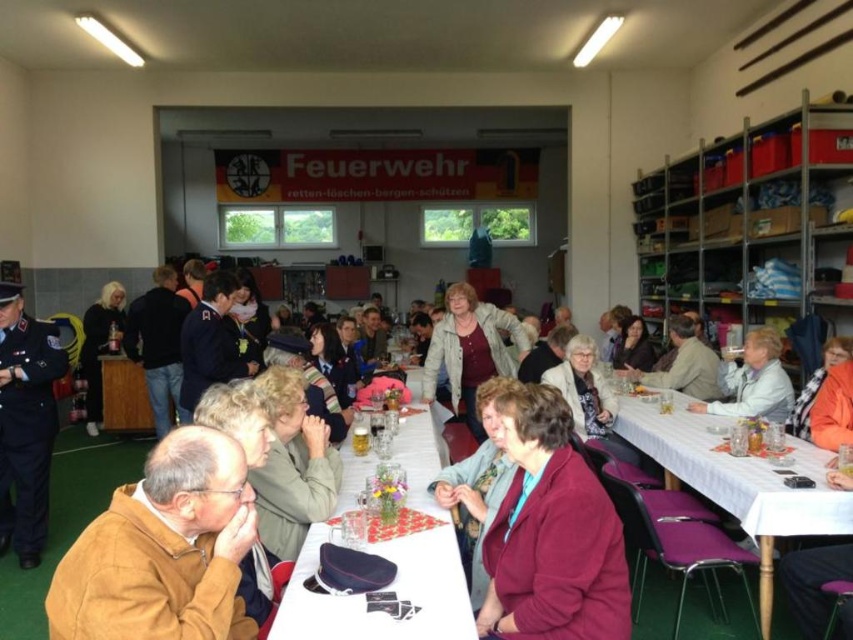
You are organizing a photo shoot and need to place two jackets on a mannequin stand. The green fabric jacket at center and the light beige jacket at center must be arranged so that the narrower one is placed on the left side. Which jacket should you place on the left?

The green fabric jacket at center has a lesser width compared to the light beige jacket at center, so you should place the green fabric jacket at center on the left side.

You are standing at the entrance of the community hall and see two points marked in the room. The first point is at coordinates point (256,488) and the second is at point (477,438). Which point is closer to you?

Point (256,488) is closer to the camera than point (477,438), so the first point is closer to you.

You are organizing a small workshop in the community hall and need to place an orange fabric jacket at lower right on a table. Which table, the white plastic table at lower right or another table, would be more suitable for placing the jacket?

The white plastic table at lower right is more suitable because its width is larger than the orange fabric jacket at lower right, providing enough space.